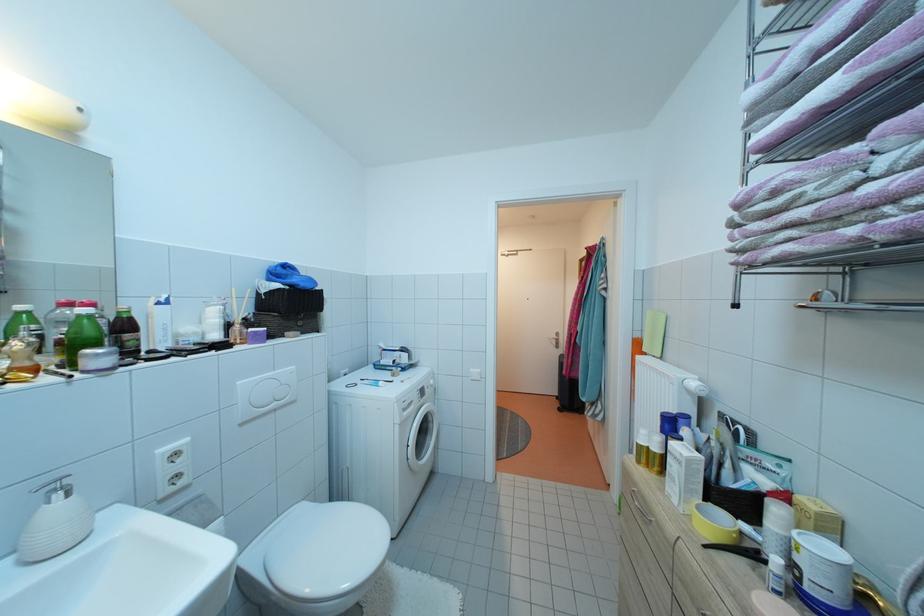
Find where to lift the white toilet lid. Please return your answer as a coordinate pair (x, y).

(326, 549)